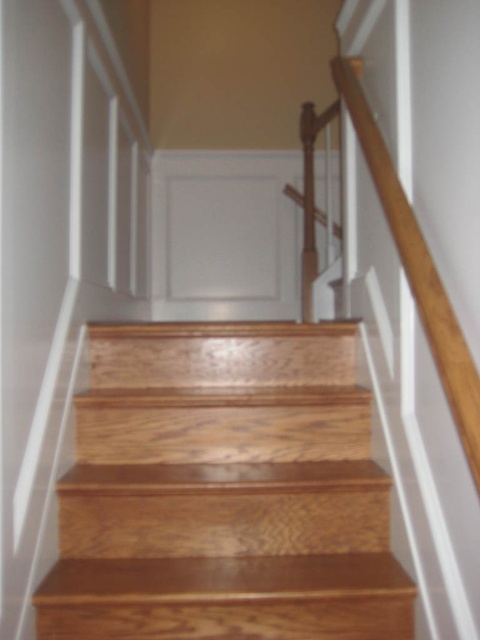
What do you see at coordinates (224, 492) in the screenshot?
I see `wooden stairs at center` at bounding box center [224, 492].

In the scene shown: Which is below, wooden stairs at center or wooden handrail at upper right?

wooden stairs at center is below.

Which is in front, point (294, 605) or point (470, 467)?

Point (470, 467) is more forward.

Image resolution: width=480 pixels, height=640 pixels. Find the location of `wooden stairs at center`. wooden stairs at center is located at coordinates (224, 492).